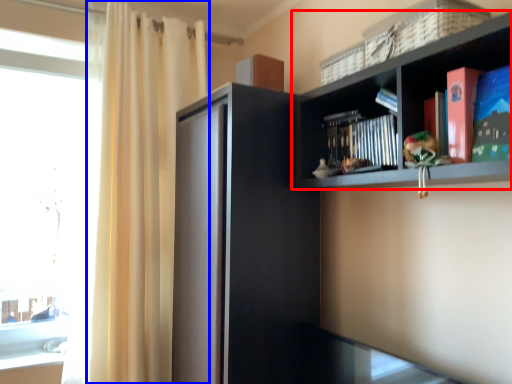
Question: Which point is further to the camera, shelf (highlighted by a red box) or curtain (highlighted by a blue box)?

Choices:
 (A) shelf
 (B) curtain

Answer: (B)